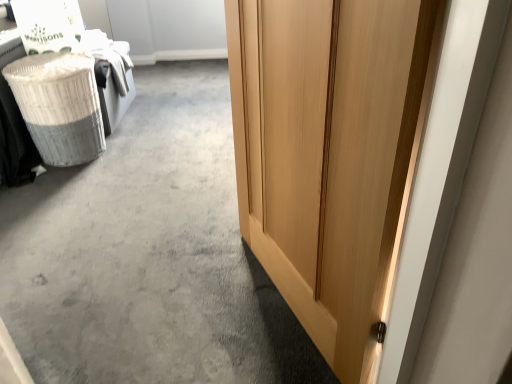
Question: Is point (30, 279) positioned closer to the camera than point (76, 79)?

Choices:
 (A) closer
 (B) farther

Answer: (A)

Question: Relative to white wicker laundry basket at left, is wooden door at right in front or behind?

Choices:
 (A) front
 (B) behind

Answer: (A)

Question: Which is farther from the wooden door at right?

Choices:
 (A) white wicker laundry basket at left
 (B) light wood door at right

Answer: (B)

Question: Which of these objects is positioned closest to the light wood door at right?

Choices:
 (A) white wicker laundry basket at left
 (B) wooden door at right

Answer: (B)